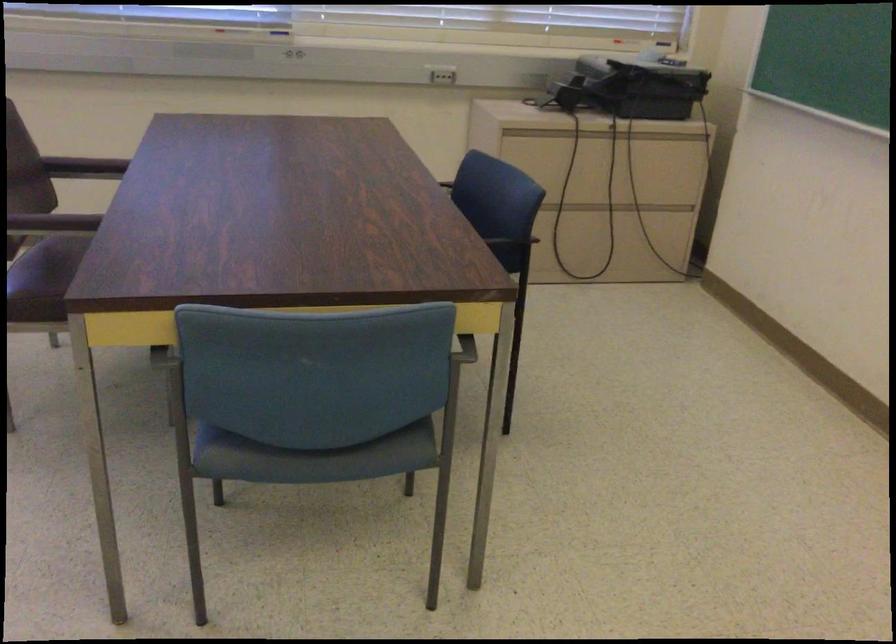
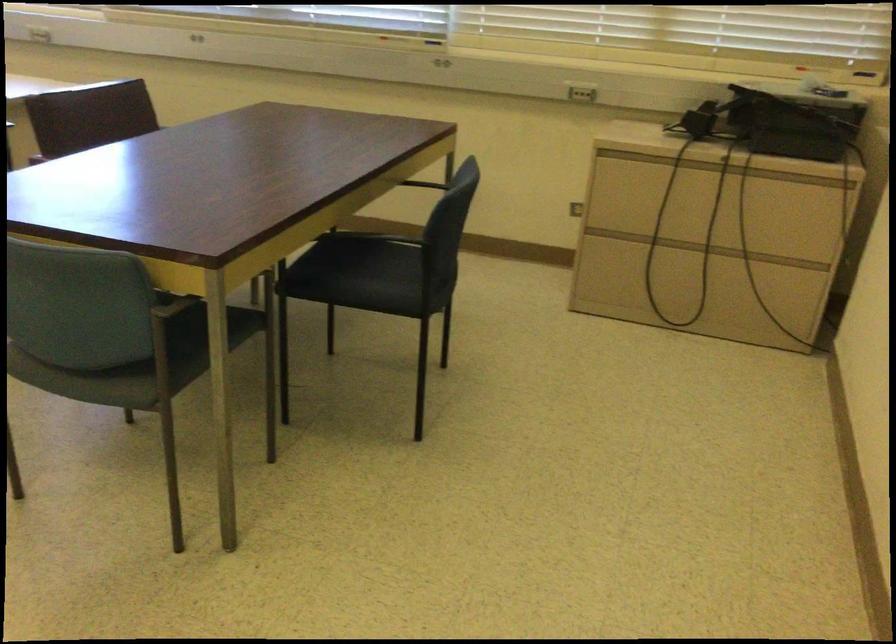
Where in the second image is the point corresponding to the point at 596,136 from the first image?

(700, 167)